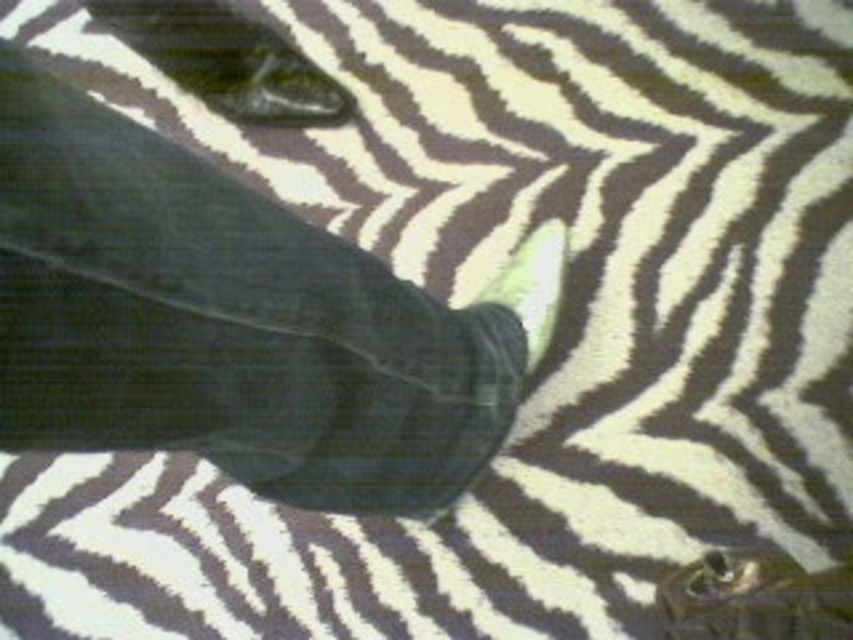
Does matte black shoe at upper left appear on the right side of white soft foot at center?

In fact, matte black shoe at upper left is to the left of white soft foot at center.

Based on the photo, does matte black shoe at upper left have a lesser width compared to white soft foot at center?

No.

Image resolution: width=853 pixels, height=640 pixels. Describe the element at coordinates (225, 60) in the screenshot. I see `matte black shoe at upper left` at that location.

This screenshot has height=640, width=853. Find the location of `matte black shoe at upper left`. matte black shoe at upper left is located at coordinates (225, 60).

Can you confirm if dark gray fabric at center is positioned below matte black shoe at upper left?

Correct, dark gray fabric at center is located below matte black shoe at upper left.

Image resolution: width=853 pixels, height=640 pixels. What do you see at coordinates (236, 321) in the screenshot?
I see `dark gray fabric at center` at bounding box center [236, 321].

Where is `dark gray fabric at center`? The height and width of the screenshot is (640, 853). dark gray fabric at center is located at coordinates (236, 321).

Based on the photo, can you confirm if dark gray fabric at center is thinner than white soft foot at center?

No.

Does dark gray fabric at center have a greater width compared to white soft foot at center?

Yes, dark gray fabric at center is wider than white soft foot at center.

Is point (262, 289) farther from viewer compared to point (527, 282)?

No, (262, 289) is in front of (527, 282).

The width and height of the screenshot is (853, 640). Identify the location of dark gray fabric at center. pos(236,321).